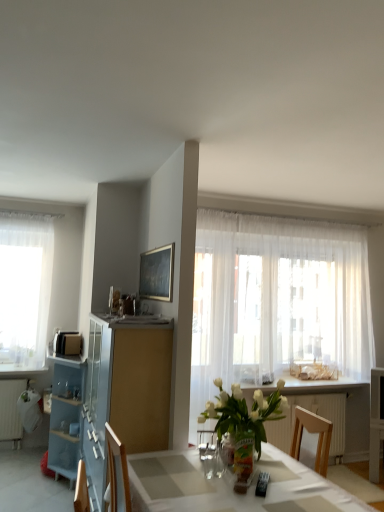
The width and height of the screenshot is (384, 512). Find the location of `spots to the right of clear glass vase at center`. spots to the right of clear glass vase at center is located at coordinates (280, 472).